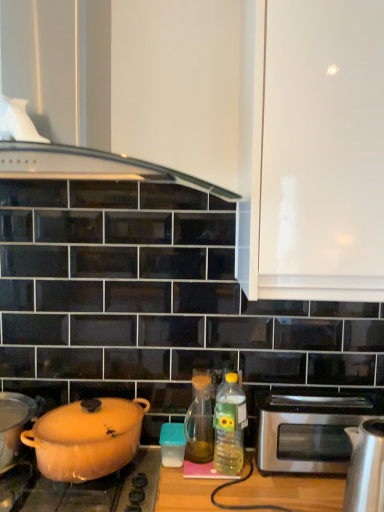
Identify the location of free space above stainless steel toaster at right (from a real-world perspective). (313, 398).